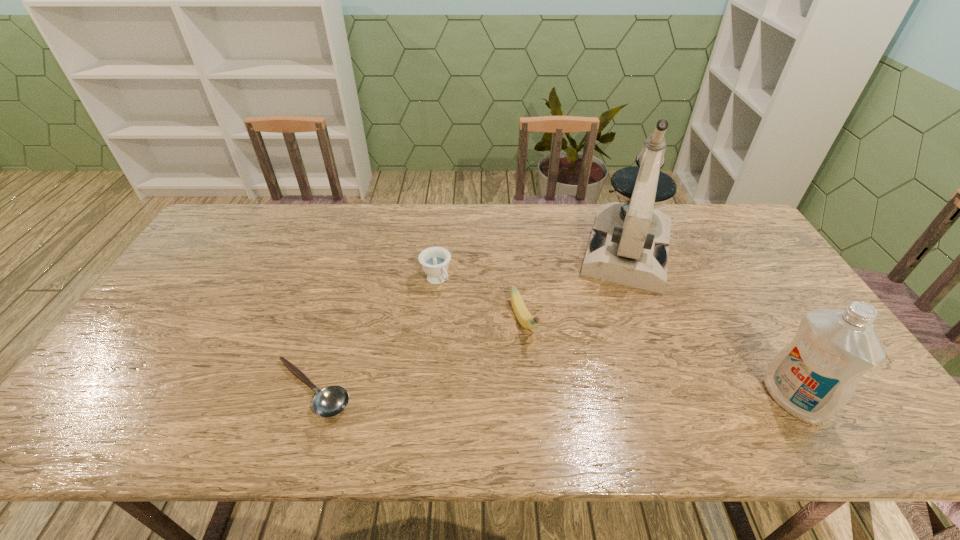
This screenshot has height=540, width=960. I want to click on free space on the desktop that is between the leftmost object and the second tallest object and is positioned on the side of the fourth object from right to left with the handle, so click(527, 394).

The height and width of the screenshot is (540, 960). I want to click on free space on the desktop that is between the shortest object and the detergent and is positioned at the stem of the banana, so click(560, 394).

You are a GUI agent. You are given a task and a screenshot of the screen. Output one action in this format:
    pyautogui.click(x=<x>, y=<y>)
    Task: Click on the vacant spot on the desktop that is between the leftmost object and the detergent and is positioned at the eyepiece of the second object from right to left
    
    Given the screenshot: What is the action you would take?
    pyautogui.click(x=600, y=395)